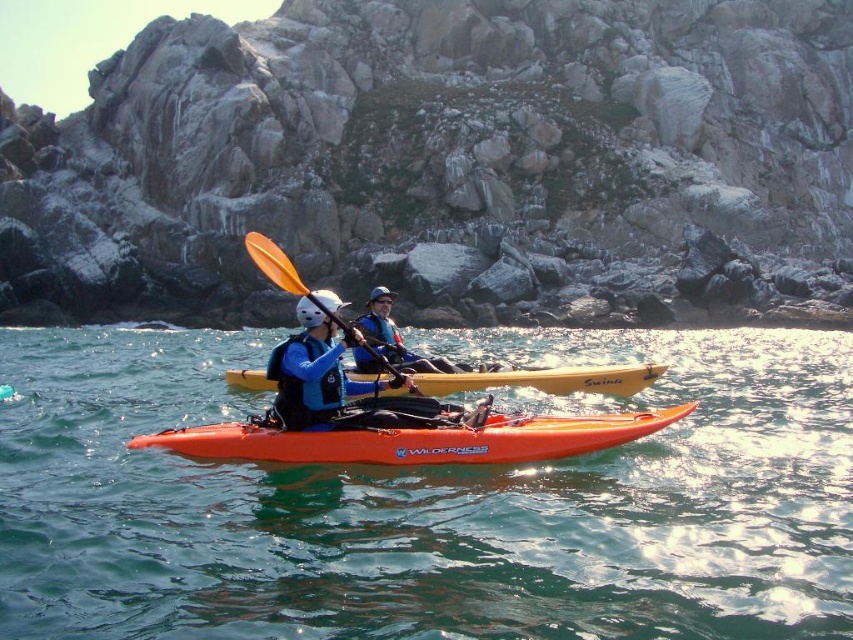
Which is more to the left, smooth gray rock at center or matte blue life vest at center?

Positioned to the left is matte blue life vest at center.

Does smooth gray rock at center have a lesser width compared to matte blue life vest at center?

No, smooth gray rock at center is not thinner than matte blue life vest at center.

Is point (4, 147) closer to viewer compared to point (322, 346)?

No, it is behind (322, 346).

What are the coordinates of `smooth gray rock at center` in the screenshot? It's located at (448, 164).

Can you confirm if translucent orange kayak at center is smaller than orange matte kayak at center?

No, translucent orange kayak at center is not smaller than orange matte kayak at center.

Which is in front, point (503, 493) or point (310, 442)?

Point (310, 442) is more forward.

Find the location of `translucent orange kayak at center`. translucent orange kayak at center is located at coordinates (428, 500).

Can you confirm if smooth gray rock at center is smaller than orange plastic paddle at center?

Answer: Actually, smooth gray rock at center might be larger than orange plastic paddle at center.

Is point (363, 156) closer to viewer compared to point (276, 248)?

That is False.

Find the location of a particular element. The height and width of the screenshot is (640, 853). smooth gray rock at center is located at coordinates (448, 164).